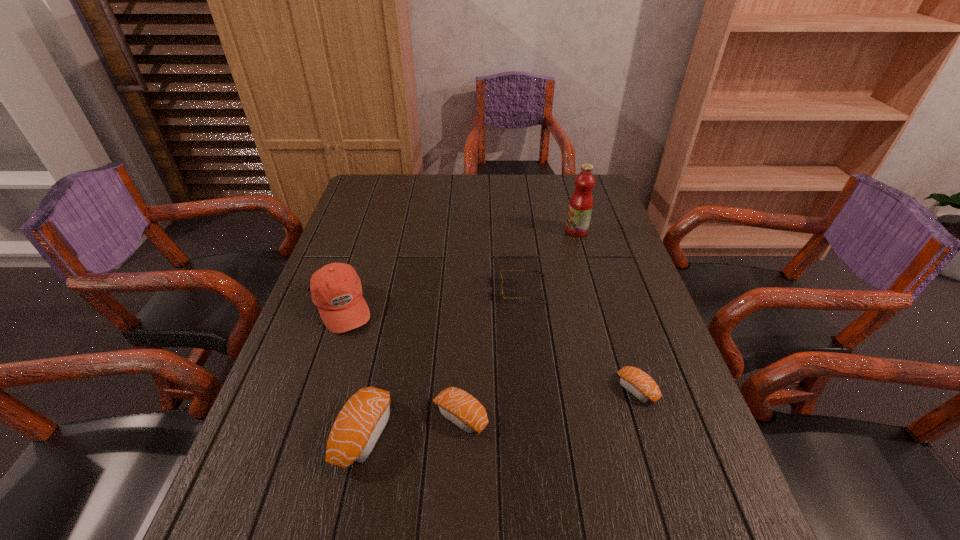
You are a GUI agent. You are given a task and a screenshot of the screen. Output one action in this format:
    pyautogui.click(x=<x>, y=<y>)
    Task: Click on the tallest sushi
    
    Given the screenshot: What is the action you would take?
    pyautogui.click(x=357, y=428)

I want to click on the third tallest object, so click(x=357, y=428).

You are a GUI agent. You are given a task and a screenshot of the screen. Output one action in this format:
    pyautogui.click(x=<x>, y=<y>)
    Task: Click on the second shortest sushi
    The image size is (960, 540).
    Given the screenshot: What is the action you would take?
    pyautogui.click(x=459, y=407)

You are a GUI agent. You are given a task and a screenshot of the screen. Output one action in this format:
    pyautogui.click(x=<x>, y=<y>)
    Task: Click on the fourth object from right to left
    This screenshot has height=540, width=960.
    Given the screenshot: What is the action you would take?
    pyautogui.click(x=459, y=407)

At what (x,y) coordinates should I click in order to perform the action: click on the rightmost sushi. Please return your answer as a coordinate pair (x, y). The image size is (960, 540). Looking at the image, I should click on (637, 382).

I want to click on the fifth shortest object, so click(336, 289).

This screenshot has width=960, height=540. In order to click on the tallest object in this screenshot , I will do `click(581, 202)`.

This screenshot has height=540, width=960. I want to click on the farthest object, so click(581, 202).

Where is `sunglasses`? This screenshot has width=960, height=540. sunglasses is located at coordinates (501, 280).

The height and width of the screenshot is (540, 960). What are the coordinates of `free space located on the right of the fourth shortest object` in the screenshot? It's located at (468, 433).